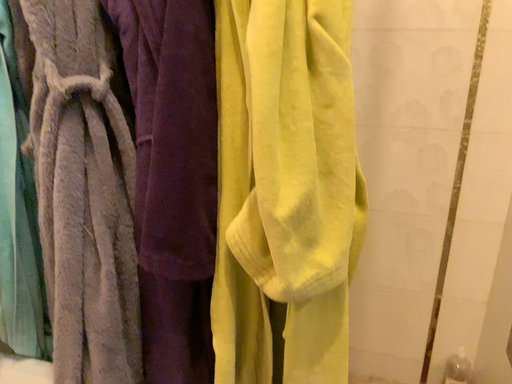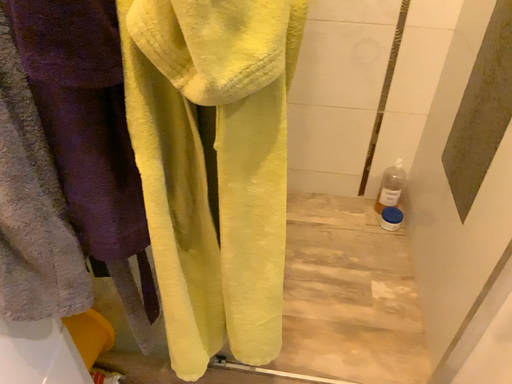
Question: Which way did the camera rotate in the video?

Choices:
 (A) rotated right
 (B) rotated left

Answer: (A)